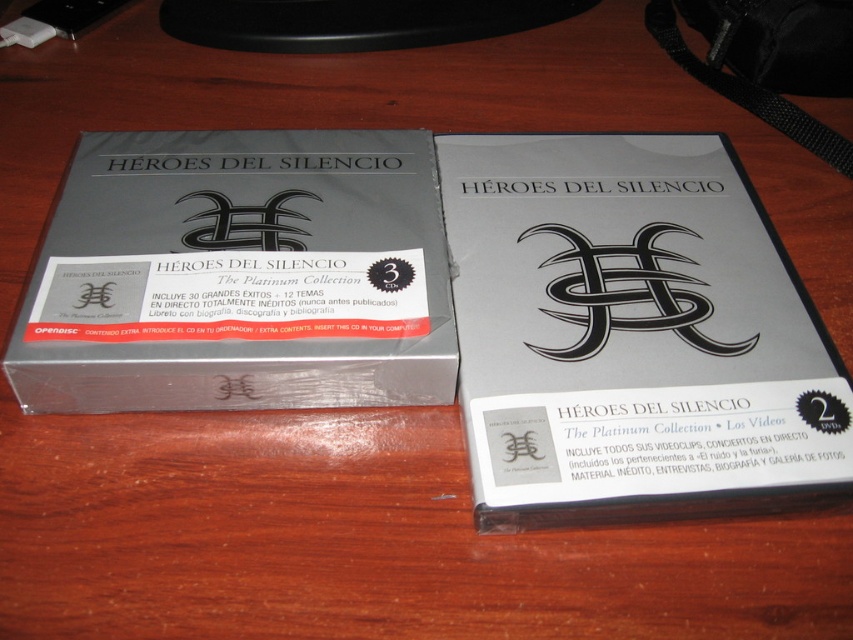
Does matte silver dvd at center appear under silver metallic box at center?

Indeed, matte silver dvd at center is positioned under silver metallic box at center.

Can you confirm if matte silver dvd at center is shorter than silver metallic box at center?

In fact, matte silver dvd at center may be taller than silver metallic box at center.

Locate an element on the screen. The height and width of the screenshot is (640, 853). matte silver dvd at center is located at coordinates (631, 333).